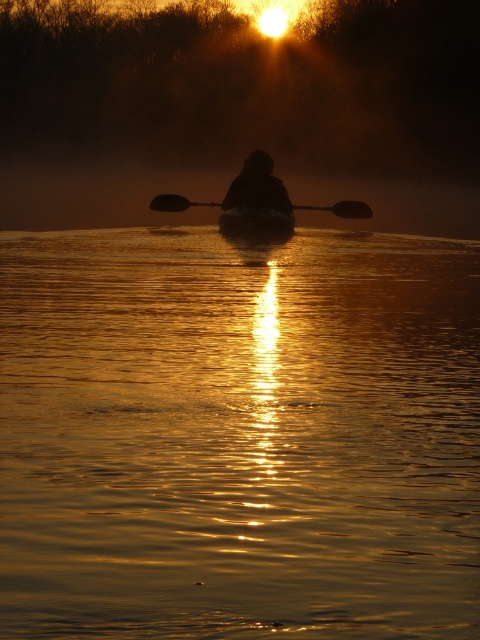
Is golden reflective water at center positioned at the back of black rubber paddle at center?

No, golden reflective water at center is in front of black rubber paddle at center.

Between point (245, 369) and point (188, 204), which one is positioned behind?

Point (188, 204)

Does point (358, 289) come farther from viewer compared to point (160, 204)?

No, (358, 289) is in front of (160, 204).

Where is `golden reflective water at center`? The image size is (480, 640). golden reflective water at center is located at coordinates (239, 435).

Does foggy mist at upper center appear under silhouette figure at center?

No.

Is foggy mist at upper center further to camera compared to silhouette figure at center?

Yes, foggy mist at upper center is further from the viewer.

Which is in front, point (408, 188) or point (243, 182)?

Positioned in front is point (243, 182).

You are a GUI agent. You are given a task and a screenshot of the screen. Output one action in this format:
    pyautogui.click(x=<x>, y=<y>)
    Task: Click on the foggy mist at upper center
    
    Given the screenshot: What is the action you would take?
    pyautogui.click(x=240, y=106)

Is silhouette figure at center smaller than smooth dark wood canoe at center?

Actually, silhouette figure at center might be larger than smooth dark wood canoe at center.

Is silhouette figure at center thinner than smooth dark wood canoe at center?

No.

Find the location of `silhouette figure at center`. silhouette figure at center is located at coordinates (257, 186).